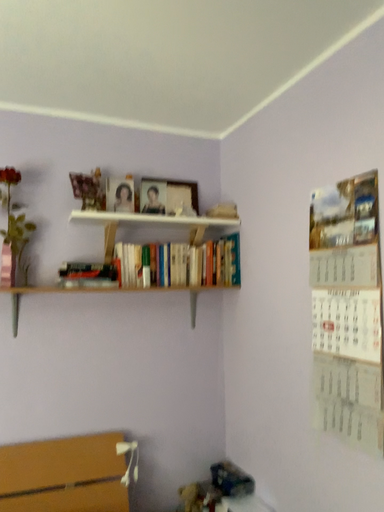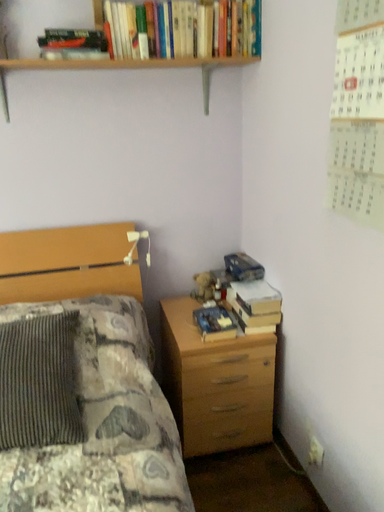
Question: How did the camera likely rotate when shooting the video?

Choices:
 (A) rotated upward
 (B) rotated downward

Answer: (B)